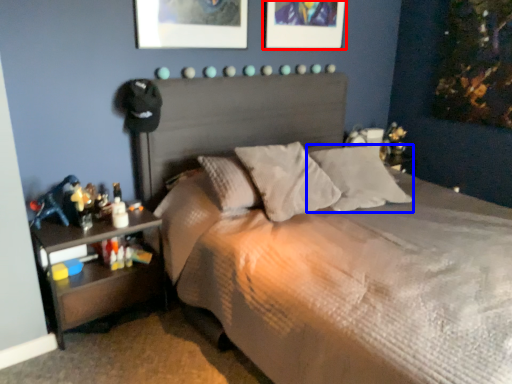
Question: Which object appears closest to the camera in this image, picture frame (highlighted by a red box) or pillow (highlighted by a blue box)?

Choices:
 (A) picture frame
 (B) pillow

Answer: (B)